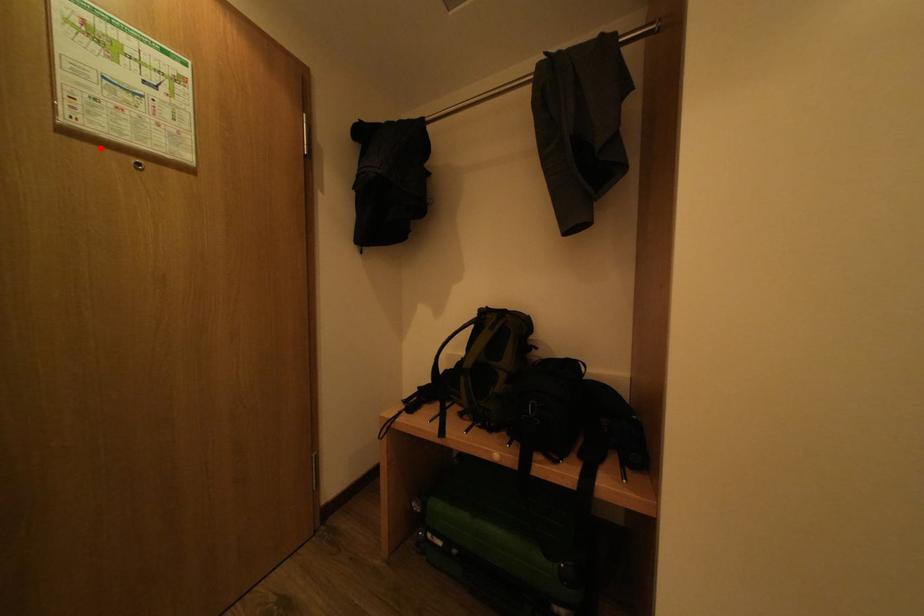
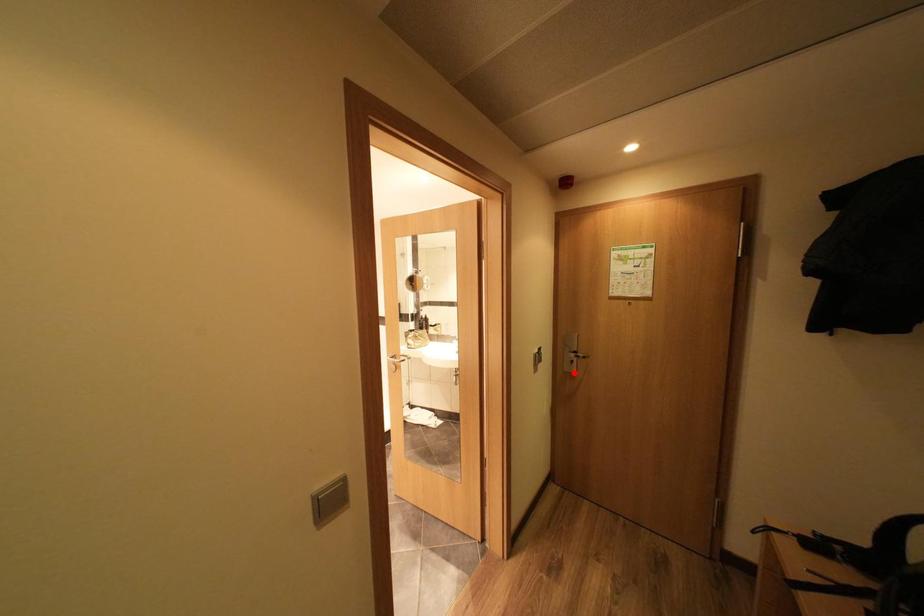
I am providing you with two images of the same scene from different viewpoints. A red point is marked on the first image and another point is marked on the second image. Are the points marked in image1 and image2 representing the same 3D position?

No